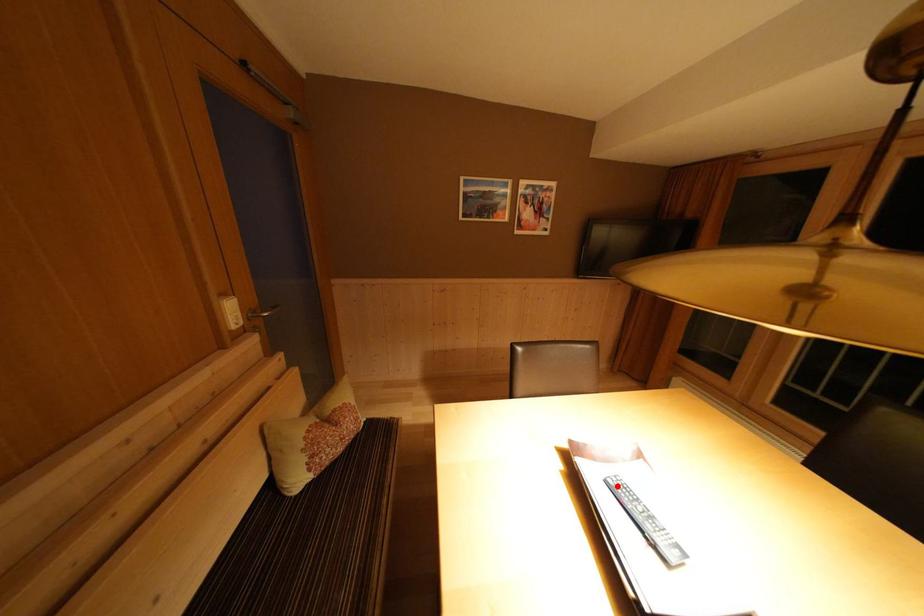
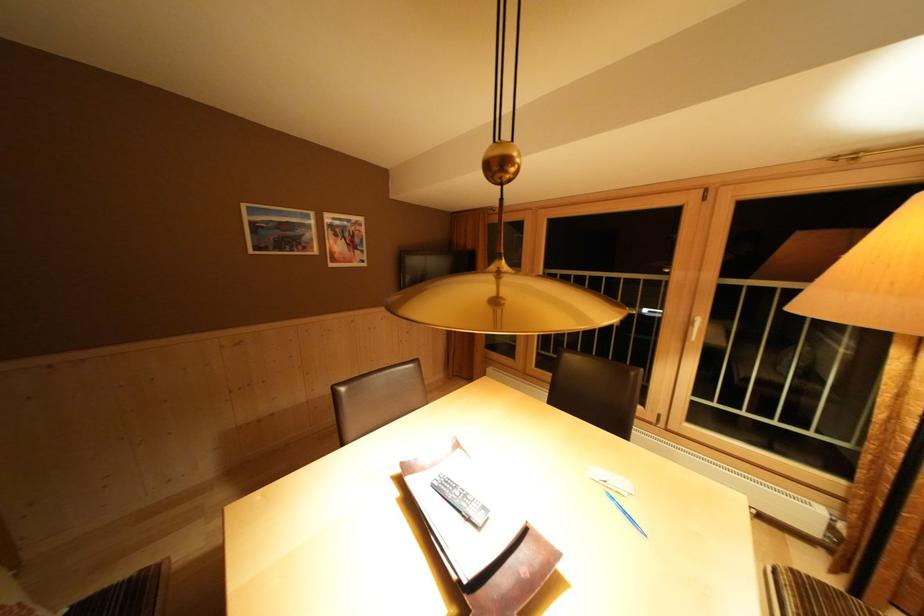
The point at the highlighted location is marked in the first image. Where is the corresponding point in the second image?

(442, 488)